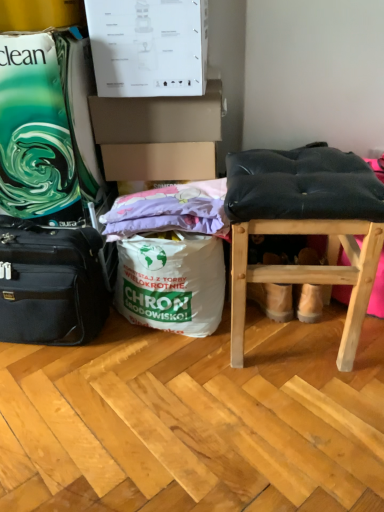
Locate an element on the screen. This screenshot has width=384, height=512. white paper bag at center is located at coordinates (171, 283).

Locate an element on the screen. The width and height of the screenshot is (384, 512). black fabric suitcase at left is located at coordinates (50, 284).

Where is `purple fabric at center`? purple fabric at center is located at coordinates pos(170,211).

What do you see at coordinates (305, 226) in the screenshot? Image resolution: width=384 pixels, height=512 pixels. I see `black leather stool at right` at bounding box center [305, 226].

Looking at this image, in order to face black leather stool at right, should I rotate leftwards or rightwards?

You should rotate right by 13.262 degrees.

I want to click on white paper bag at center, so click(171, 283).

From the image's perspective, which is below, black leather stool at right or purple fabric at center?

black leather stool at right is shown below in the image.

Can you confirm if black leather stool at right is bigger than purple fabric at center?

Yes.

From a real-world perspective, is black leather stool at right over purple fabric at center?

No, from a real-world perspective, black leather stool at right is not on top of purple fabric at center.

Does point (81, 322) come in front of point (303, 193)?

No, it is not.

Considering the relative positions of black fabric suitcase at left and black leather stool at right in the image provided, is black fabric suitcase at left in front of black leather stool at right?

No, black fabric suitcase at left is further to the viewer.

From a real-world perspective, relative to black leather stool at right, is black fabric suitcase at left vertically above or below?

black fabric suitcase at left is below black leather stool at right.

Consider the image. From a real-world perspective, is purple fabric at center below black leather stool at right?

No, from a real-world perspective, purple fabric at center is not under black leather stool at right.

Is purple fabric at center smaller than black leather stool at right?

Yes, purple fabric at center is smaller than black leather stool at right.

Considering the points (112, 210) and (344, 221), which point is in front, point (112, 210) or point (344, 221)?

The point (344, 221) is closer to the camera.

Is purple fabric at center spatially inside black leather stool at right, or outside of it?

purple fabric at center is not enclosed by black leather stool at right.

From the image's perspective, which is below, black fabric suitcase at left or purple fabric at center?

black fabric suitcase at left, from the image's perspective.

Is black fabric suitcase at left far from purple fabric at center?

No, black fabric suitcase at left is in close proximity to purple fabric at center.

Relative to purple fabric at center, is black fabric suitcase at left in front or behind?

In the image, black fabric suitcase at left appears in front of purple fabric at center.

Between black fabric suitcase at left and purple fabric at center, which one has more height?

Standing taller between the two is black fabric suitcase at left.

Does black leather stool at right appear on the left side of black fabric suitcase at left?

No, black leather stool at right is not to the left of black fabric suitcase at left.

You are a GUI agent. You are given a task and a screenshot of the screen. Output one action in this format:
    pyautogui.click(x=<x>, y=<y>)
    Task: Click on the stool above the black fabric suitcase at left (from the image's perspective)
    This screenshot has width=384, height=512.
    Given the screenshot: What is the action you would take?
    pyautogui.click(x=305, y=226)

Considering the sizes of black leather stool at right and black fabric suitcase at left in the image, is black leather stool at right taller or shorter than black fabric suitcase at left?

black leather stool at right is taller than black fabric suitcase at left.

From a real-world perspective, is black leather stool at right on top of black fabric suitcase at left?

Yes, from a real-world perspective, black leather stool at right is over black fabric suitcase at left

Looking at this image, can you confirm if purple fabric at center is positioned to the right of black fabric suitcase at left?

Indeed, purple fabric at center is positioned on the right side of black fabric suitcase at left.

In the scene shown: Which is closer to the camera, (163, 203) or (3, 320)?

Point (163, 203) is closer to the camera than point (3, 320).

Who is shorter, purple fabric at center or black fabric suitcase at left?

Standing shorter between the two is purple fabric at center.

Looking at this image, considering their positions, is purple fabric at center located in front of or behind black fabric suitcase at left?

In the image, purple fabric at center appears behind black fabric suitcase at left.

Based on the photo, between white paper bag at center and purple fabric at center, which one has smaller size?

Smaller between the two is purple fabric at center.

Considering the sizes of white paper bag at center and purple fabric at center in the image, is white paper bag at center wider or thinner than purple fabric at center?

In the image, white paper bag at center appears to be wider than purple fabric at center.

From a real-world perspective, which is physically below, white paper bag at center or purple fabric at center?

white paper bag at center.

Where is `stool that appears in front of the purple fabric at center`? The width and height of the screenshot is (384, 512). stool that appears in front of the purple fabric at center is located at coordinates (305, 226).

Identify the location of stool that is above the black fabric suitcase at left (from a real-world perspective). (305, 226).

From the image, which object appears to be nearer to black leather stool at right, white paper bag at center or black fabric suitcase at left?

white paper bag at center lies closer to black leather stool at right than the other object.

Based on the photo, considering their positions, is black fabric suitcase at left positioned further to white paper bag at center than purple fabric at center?

black fabric suitcase at left lies further to white paper bag at center than the other object.

From the image, which object appears to be farther from white paper bag at center, black leather stool at right or purple fabric at center?

black leather stool at right.

When comparing their distances from purple fabric at center, does black leather stool at right or white paper bag at center seem closer?

The object closer to purple fabric at center is white paper bag at center.

From the image, which object appears to be farther from purple fabric at center, white paper bag at center or black leather stool at right?

The object further to purple fabric at center is black leather stool at right.

Considering their positions, is black fabric suitcase at left positioned closer to black leather stool at right than white paper bag at center?

white paper bag at center is closer to black leather stool at right.

Considering their positions, is purple fabric at center positioned further to black fabric suitcase at left than white paper bag at center?

purple fabric at center lies further to black fabric suitcase at left than the other object.

From the image, which object appears to be farther from black fabric suitcase at left, purple fabric at center or black leather stool at right?

Based on the image, black leather stool at right appears to be further to black fabric suitcase at left.

I want to click on material between black fabric suitcase at left and white paper bag at center in the horizontal direction, so click(x=170, y=211).

Where is `material between black fabric suitcase at left and black leather stool at right in the horizontal direction`? This screenshot has width=384, height=512. material between black fabric suitcase at left and black leather stool at right in the horizontal direction is located at coordinates pos(170,211).

Where is `shopping bag between purple fabric at center and black leather stool at right`? shopping bag between purple fabric at center and black leather stool at right is located at coordinates (171, 283).

The height and width of the screenshot is (512, 384). In order to click on shopping bag between black fabric suitcase at left and black leather stool at right from left to right in this screenshot , I will do `click(171, 283)`.